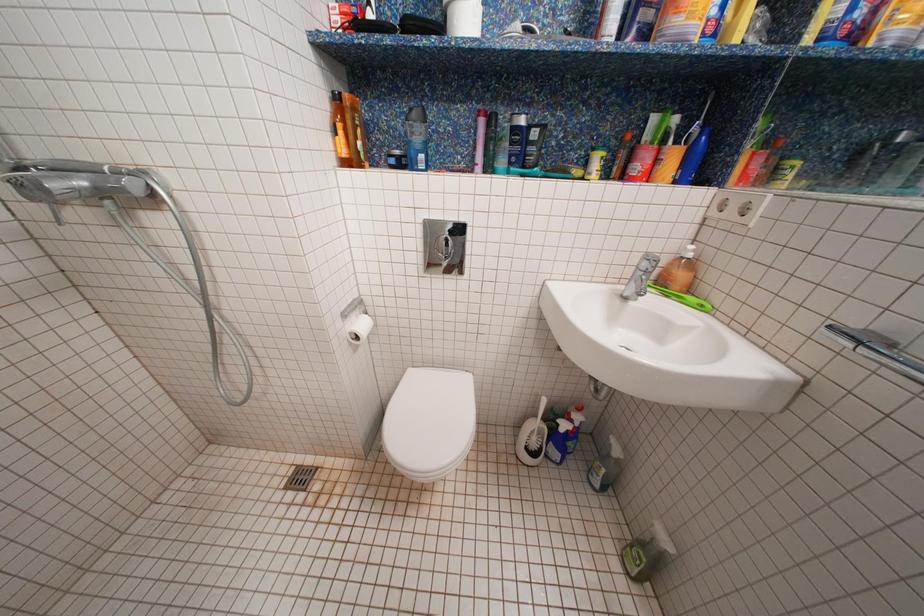
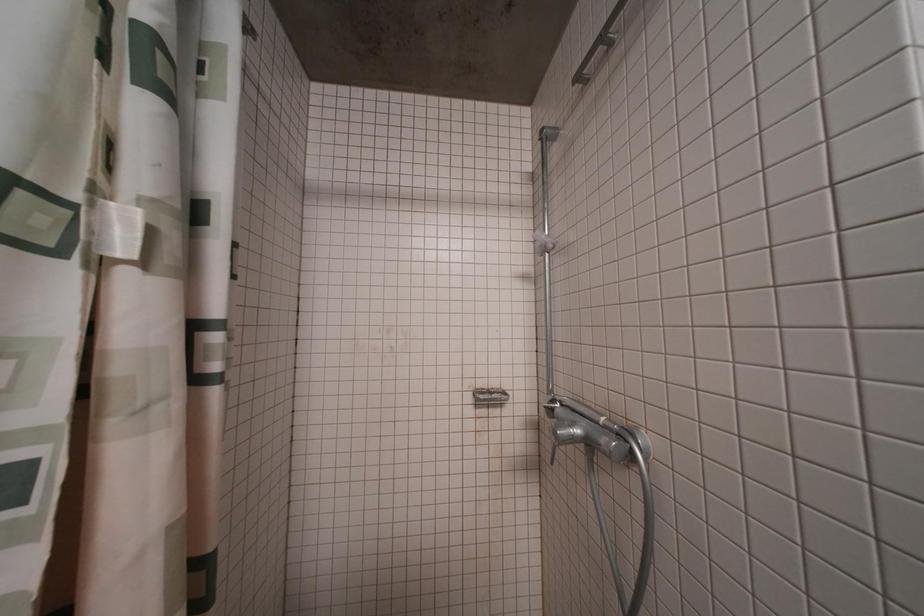
Question: The images are taken continuously from a first-person perspective. In which direction is your viewpoint rotating?

Choices:
 (A) Left
 (B) Right
 (C) Up
 (D) Down

Answer: (A)